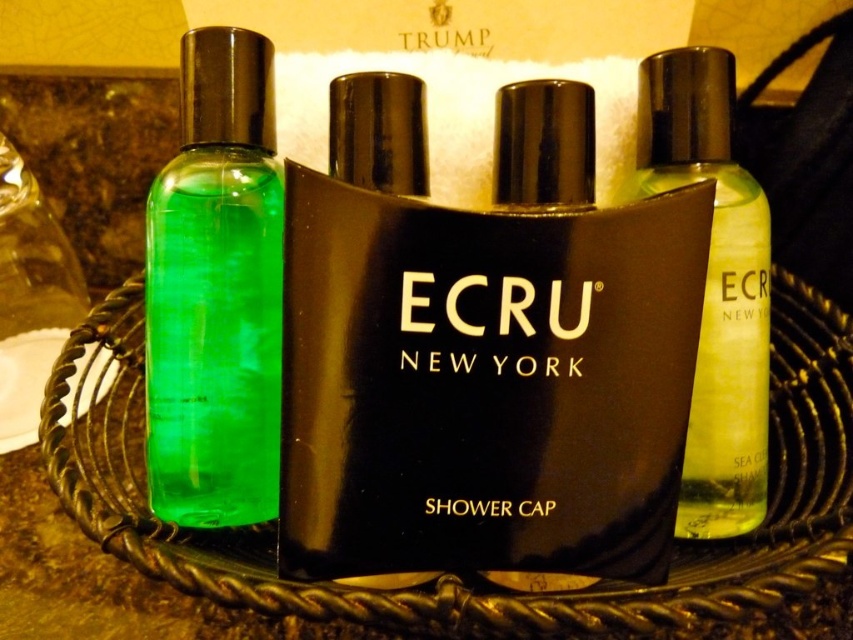
Question: Which of the following is the farthest from the observer?

Choices:
 (A) (730, 129)
 (B) (230, 99)
 (C) (412, 412)

Answer: (A)

Question: Based on their relative distances, which object is nearer to the black matte shower cap at center?

Choices:
 (A) transparent yellow liquid at right
 (B) black glossy shower cap at center

Answer: (B)

Question: Is black glossy shower cap at center positioned before green translucent bottle at left?

Choices:
 (A) yes
 (B) no

Answer: (A)

Question: Does black glossy shower cap at center come behind black matte shower cap at center?

Choices:
 (A) no
 (B) yes

Answer: (A)

Question: Which object is closer to the camera taking this photo?

Choices:
 (A) black glossy shower cap at center
 (B) transparent yellow liquid at right
 (C) black matte shower cap at center
 (D) green translucent bottle at left

Answer: (A)

Question: Does black glossy shower cap at center have a greater width compared to green translucent bottle at left?

Choices:
 (A) no
 (B) yes

Answer: (B)